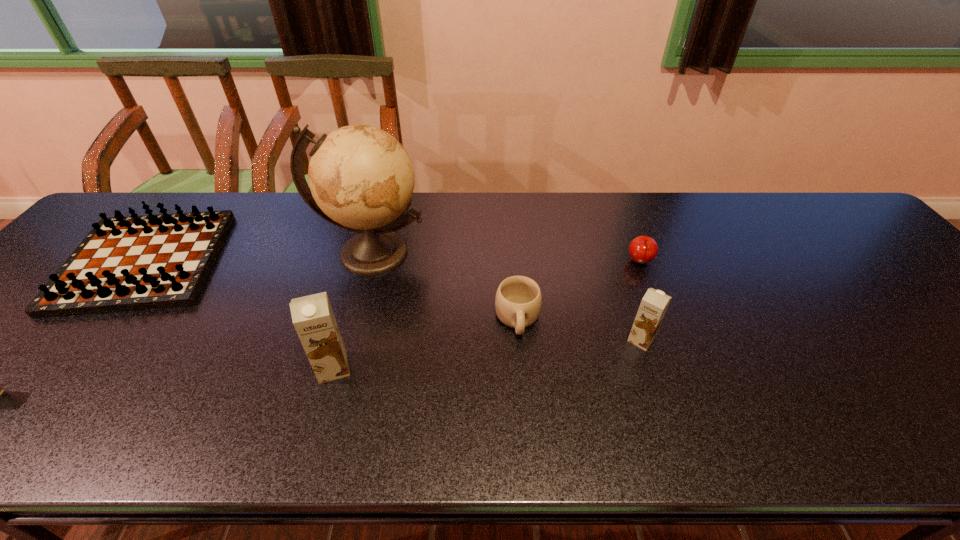
Considering the uniform spacing of chocolate milks, where should an additional chocolate milk be positioned on the right? Please locate a free spot. Please provide its 2D coordinates. Your answer should be formatted as a tuple, i.e. [(x, y)], where the tuple contains the x and y coordinates of a point satisfying the conditions above.

[(918, 314)]